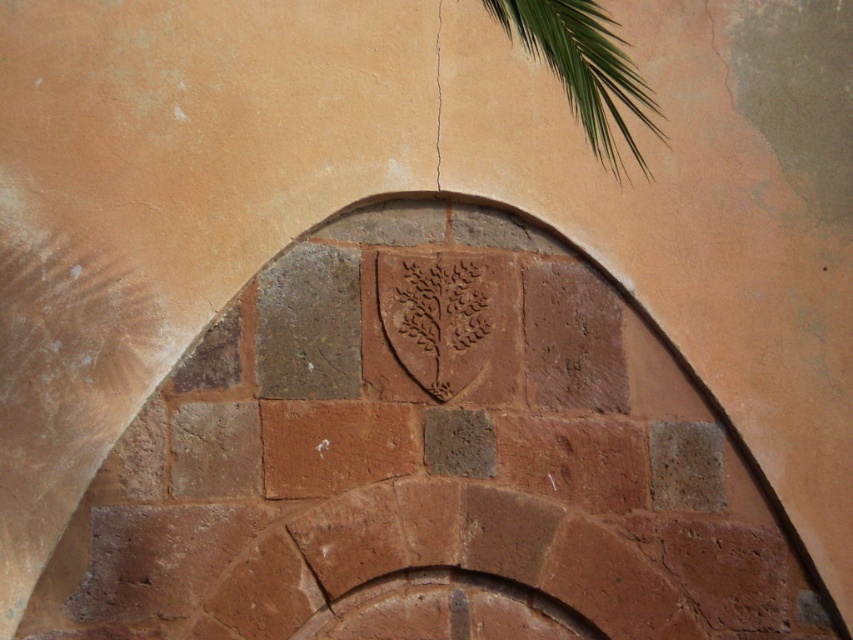
Between rustic stone archway at center and green leafy palm at upper right, which one is positioned lower?

rustic stone archway at center is below.

This screenshot has height=640, width=853. Identify the location of rustic stone archway at center. (430, 461).

Image resolution: width=853 pixels, height=640 pixels. What are the coordinates of `rustic stone archway at center` in the screenshot? It's located at (430, 461).

Can you confirm if rustic stone archway at center is positioned above red stone brick at center?

Incorrect, rustic stone archway at center is not positioned above red stone brick at center.

Does rustic stone archway at center have a greater height compared to red stone brick at center?

Indeed, rustic stone archway at center has a greater height compared to red stone brick at center.

The width and height of the screenshot is (853, 640). Identify the location of rustic stone archway at center. (430, 461).

Which is in front, point (608, 166) or point (403, 456)?

Positioned in front is point (403, 456).

Is green leafy palm at upper right above red stone brick at center?

Correct, green leafy palm at upper right is located above red stone brick at center.

Is point (611, 148) farther from camera compared to point (270, 467)?

Yes, point (611, 148) is farther from viewer.

I want to click on green leafy palm at upper right, so click(584, 68).